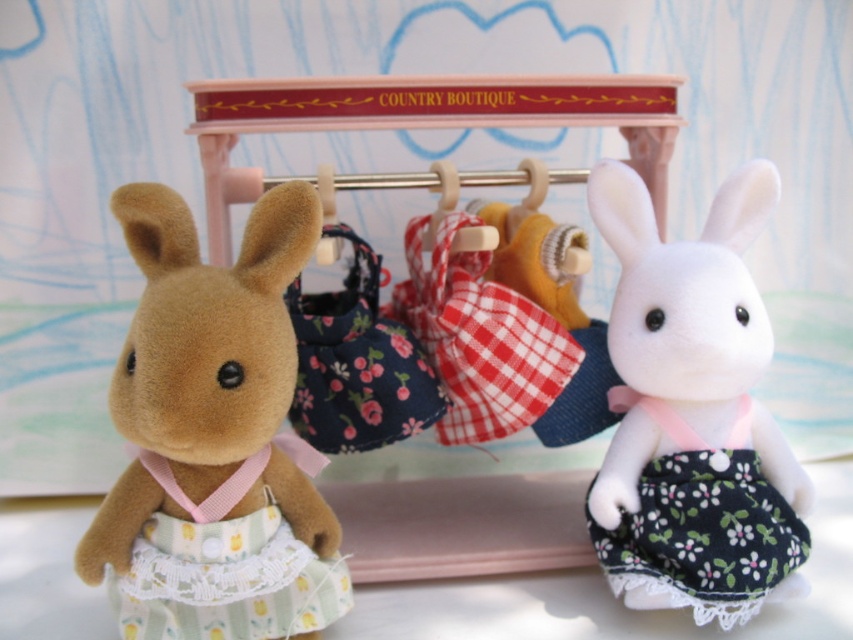
Question: Which object appears closest to the camera in this image?

Choices:
 (A) white fabric dress at right
 (B) fluffy brown plush at left
 (C) black floral fabric dress at center

Answer: (B)

Question: Does fluffy brown plush at left have a lesser width compared to black floral fabric dress at center?

Choices:
 (A) no
 (B) yes

Answer: (A)

Question: Which object appears farthest from the camera in this image?

Choices:
 (A) fluffy brown plush at left
 (B) black floral fabric dress at center
 (C) white fabric dress at right

Answer: (B)

Question: Is fluffy brown plush at left below white fabric dress at right?

Choices:
 (A) no
 (B) yes

Answer: (B)

Question: Which point is closer to the camera?

Choices:
 (A) fluffy brown plush at left
 (B) black floral fabric dress at center

Answer: (A)

Question: Does fluffy brown plush at left have a lesser width compared to black floral fabric dress at center?

Choices:
 (A) yes
 (B) no

Answer: (B)